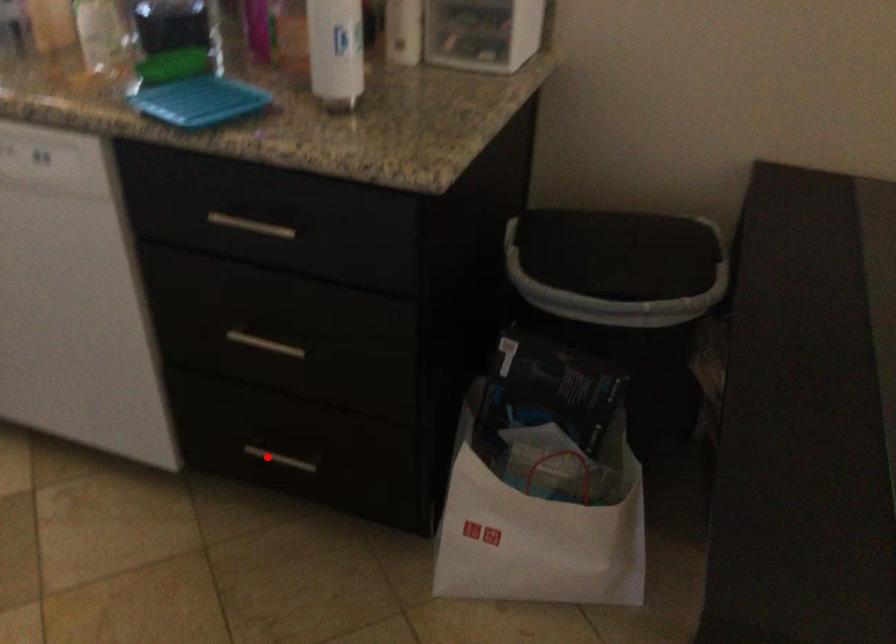
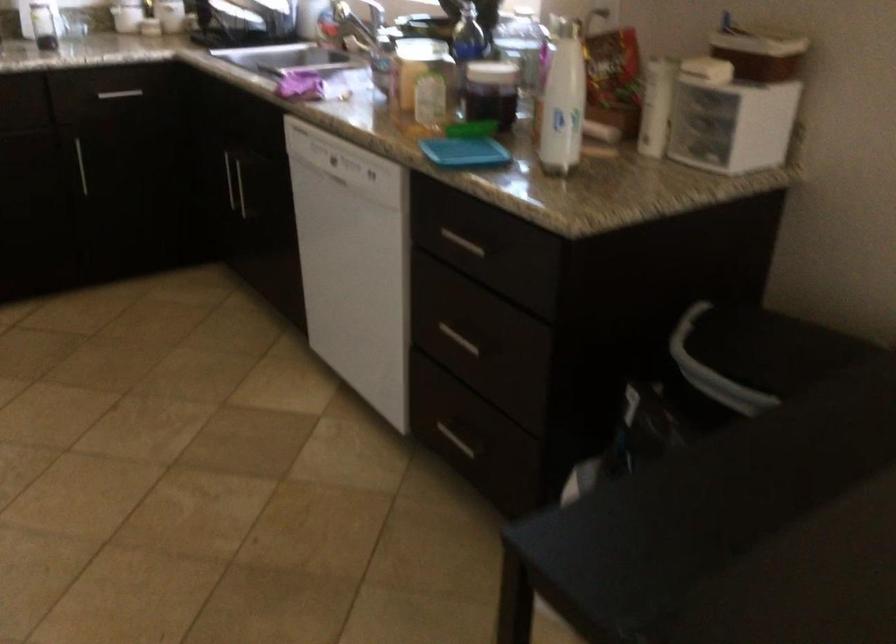
Question: I am providing you with two images of the same scene from different viewpoints. In image1, a red point is highlighted. Considering the same 3D point in image2, which of the following is correct?

Choices:
 (A) It is closer
 (B) It is farther

Answer: (B)